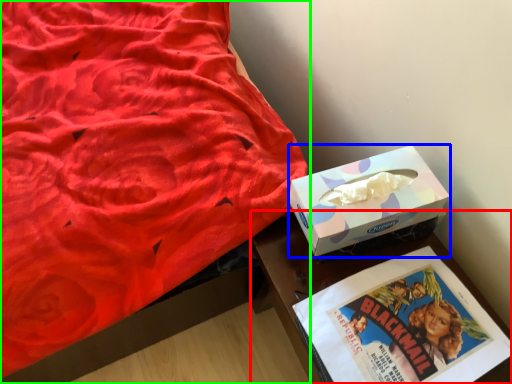
Question: Which object is positioned farthest from table (highlighted by a red box)? Select from box (highlighted by a blue box) and bed (highlighted by a green box).

Choices:
 (A) box
 (B) bed

Answer: (B)